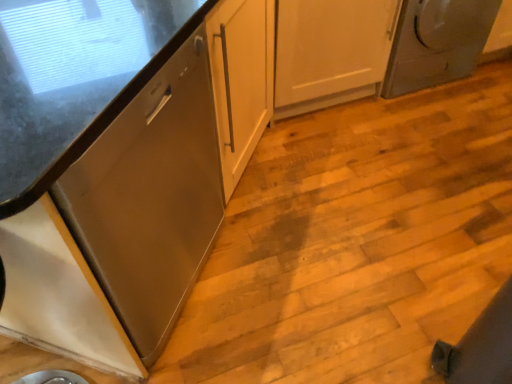
Question: Is satin silver dryer at upper right bigger than satin wood cabinet at left, positioned as the 2th cabinetry in bottom-to-top order?

Choices:
 (A) yes
 (B) no

Answer: (B)

Question: Does satin silver dryer at upper right come in front of satin wood cabinet at left, the 1th cabinetry positioned from the top?

Choices:
 (A) yes
 (B) no

Answer: (B)

Question: Is satin silver dryer at upper right aimed at satin wood cabinet at left, positioned as the 2th cabinetry in bottom-to-top order?

Choices:
 (A) no
 (B) yes

Answer: (A)

Question: Considering the relative sizes of satin silver dryer at upper right and satin wood cabinet at left, the 1th cabinetry positioned from the top, in the image provided, is satin silver dryer at upper right thinner than satin wood cabinet at left, the 1th cabinetry positioned from the top,?

Choices:
 (A) yes
 (B) no

Answer: (A)

Question: From the image's perspective, does satin silver dryer at upper right appear higher than satin wood cabinet at left, the 1th cabinetry positioned from the top?

Choices:
 (A) yes
 (B) no

Answer: (A)

Question: Can you confirm if satin silver dryer at upper right is positioned to the left of satin wood cabinet at left, positioned as the 2th cabinetry in bottom-to-top order?

Choices:
 (A) no
 (B) yes

Answer: (A)

Question: From a real-world perspective, does satin silver dryer at upper right sit lower than white glossy cabinet at lower left, arranged as the second cabinetry when viewed from the top?

Choices:
 (A) yes
 (B) no

Answer: (A)

Question: Would you say satin silver dryer at upper right is a long distance from white glossy cabinet at lower left, arranged as the second cabinetry when viewed from the top?

Choices:
 (A) yes
 (B) no

Answer: (A)

Question: From a real-world perspective, is satin silver dryer at upper right physically above white glossy cabinet at lower left, the first cabinetry in the bottom-to-top sequence?

Choices:
 (A) no
 (B) yes

Answer: (A)

Question: From the image's perspective, is satin silver dryer at upper right located above white glossy cabinet at lower left, arranged as the second cabinetry when viewed from the top?

Choices:
 (A) yes
 (B) no

Answer: (A)

Question: Is satin silver dryer at upper right further to camera compared to white glossy cabinet at lower left, arranged as the second cabinetry when viewed from the top?

Choices:
 (A) yes
 (B) no

Answer: (A)

Question: Is satin silver dryer at upper right positioned beyond the bounds of white glossy cabinet at lower left, the first cabinetry in the bottom-to-top sequence?

Choices:
 (A) yes
 (B) no

Answer: (A)

Question: Is satin wood cabinet at left, the 1th cabinetry positioned from the top, bigger than white glossy cabinet at lower left, the first cabinetry in the bottom-to-top sequence?

Choices:
 (A) no
 (B) yes

Answer: (B)